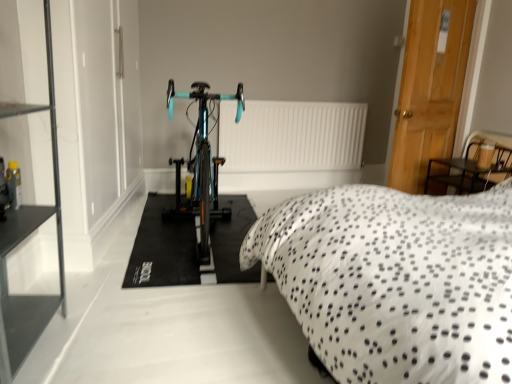
Question: Are white dotted fabric at center and teal glossy bicycle at center far apart?

Choices:
 (A) yes
 (B) no

Answer: (A)

Question: Does white dotted fabric at center have a greater height compared to teal glossy bicycle at center?

Choices:
 (A) no
 (B) yes

Answer: (A)

Question: Considering the relative sizes of white dotted fabric at center and teal glossy bicycle at center in the image provided, is white dotted fabric at center wider than teal glossy bicycle at center?

Choices:
 (A) no
 (B) yes

Answer: (B)

Question: Considering the relative sizes of white dotted fabric at center and teal glossy bicycle at center in the image provided, is white dotted fabric at center bigger than teal glossy bicycle at center?

Choices:
 (A) no
 (B) yes

Answer: (B)

Question: Does white dotted fabric at center lie in front of teal glossy bicycle at center?

Choices:
 (A) yes
 (B) no

Answer: (A)

Question: Considering their positions, is white matte radiator at center located in front of or behind wooden door at right?

Choices:
 (A) front
 (B) behind

Answer: (B)

Question: From a real-world perspective, relative to wooden door at right, is white matte radiator at center vertically above or below?

Choices:
 (A) below
 (B) above

Answer: (A)

Question: In terms of size, does white matte radiator at center appear bigger or smaller than wooden door at right?

Choices:
 (A) small
 (B) big

Answer: (A)

Question: Is white matte radiator at center spatially inside wooden door at right, or outside of it?

Choices:
 (A) outside
 (B) inside

Answer: (A)

Question: Would you say wooden door at right is to the left or to the right of black glass shelf at left in the picture?

Choices:
 (A) right
 (B) left

Answer: (A)

Question: In terms of size, does wooden door at right appear bigger or smaller than black glass shelf at left?

Choices:
 (A) small
 (B) big

Answer: (A)

Question: From the image's perspective, is wooden door at right positioned above or below black glass shelf at left?

Choices:
 (A) below
 (B) above

Answer: (B)

Question: Does point (437, 122) appear closer or farther from the camera than point (56, 157)?

Choices:
 (A) farther
 (B) closer

Answer: (A)

Question: In terms of size, does teal glossy bicycle at center appear bigger or smaller than white matte radiator at center?

Choices:
 (A) small
 (B) big

Answer: (B)

Question: In the image, is teal glossy bicycle at center positioned in front of or behind white matte radiator at center?

Choices:
 (A) front
 (B) behind

Answer: (A)